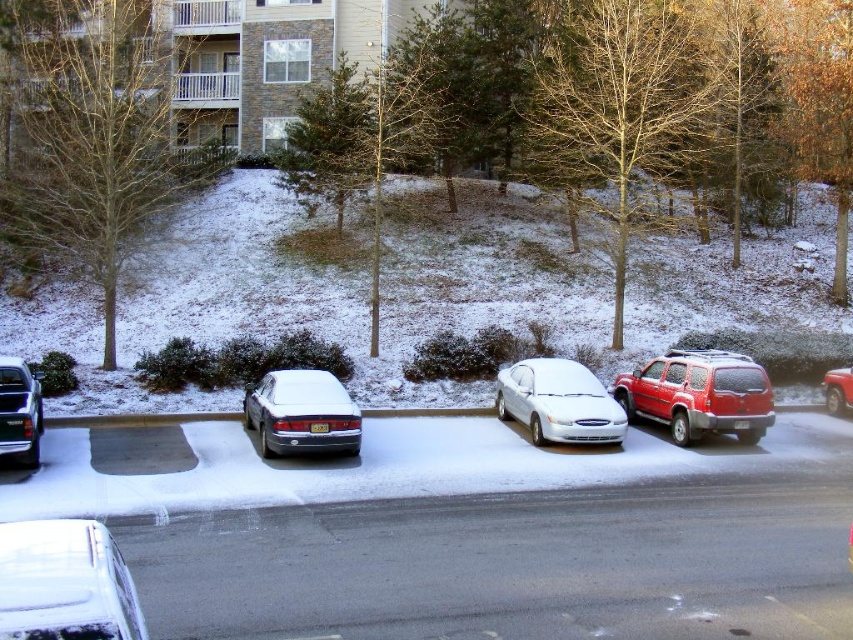
Question: In this image, where is matte red suv at center right located relative to sleek silver sedan at center?

Choices:
 (A) below
 (B) above

Answer: (B)

Question: Based on their relative distances, which object is farther from the shiny red suv at right?

Choices:
 (A) sleek silver sedan at center
 (B) white glossy sedan at center
 (C) shiny black truck at left

Answer: (C)

Question: Is white glossy sedan at lower left wider than sleek silver sedan at center?

Choices:
 (A) yes
 (B) no

Answer: (B)

Question: Is white glossy sedan at lower left above sleek silver sedan at center?

Choices:
 (A) no
 (B) yes

Answer: (B)

Question: Estimate the real-world distances between objects in this image. Which object is farther from the shiny black truck at left?

Choices:
 (A) shiny red suv at right
 (B) white matte car at center
 (C) white glossy sedan at lower left
 (D) sleek silver sedan at center

Answer: (A)

Question: Estimate the real-world distances between objects in this image. Which object is farther from the white glossy sedan at lower left?

Choices:
 (A) white glossy sedan at center
 (B) matte red suv at center right
 (C) white matte car at center
 (D) shiny black truck at left

Answer: (B)